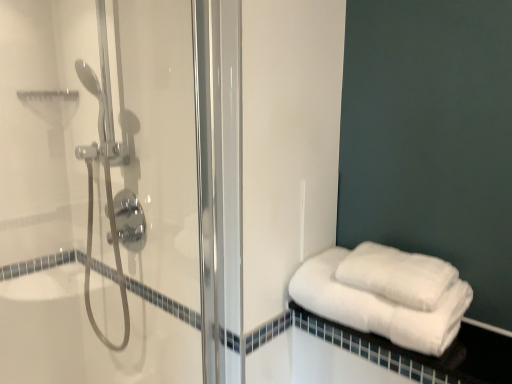
Question: Considering the relative sizes of clear glass shower door at left and white fluffy towels at right, marked as the second towel in a top-to-bottom arrangement, in the image provided, is clear glass shower door at left smaller than white fluffy towels at right, marked as the second towel in a top-to-bottom arrangement,?

Choices:
 (A) no
 (B) yes

Answer: (A)

Question: Is clear glass shower door at left positioned beyond the bounds of white fluffy towels at right, the first towel in the bottom-to-top sequence?

Choices:
 (A) yes
 (B) no

Answer: (A)

Question: Is the depth of clear glass shower door at left greater than that of white fluffy towels at right, marked as the second towel in a top-to-bottom arrangement?

Choices:
 (A) no
 (B) yes

Answer: (A)

Question: Does clear glass shower door at left have a larger size compared to white fluffy towels at right, marked as the second towel in a top-to-bottom arrangement?

Choices:
 (A) yes
 (B) no

Answer: (A)

Question: Considering the relative sizes of clear glass shower door at left and white fluffy towels at right, the first towel in the bottom-to-top sequence, in the image provided, is clear glass shower door at left taller than white fluffy towels at right, the first towel in the bottom-to-top sequence,?

Choices:
 (A) yes
 (B) no

Answer: (A)

Question: Considering the positions of white fluffy towels at right, the first towel in the bottom-to-top sequence, and white fluffy towels at lower right, which is the second towel from bottom to top, in the image, is white fluffy towels at right, the first towel in the bottom-to-top sequence, taller or shorter than white fluffy towels at lower right, which is the second towel from bottom to top,?

Choices:
 (A) tall
 (B) short

Answer: (A)

Question: Considering the positions of white fluffy towels at right, marked as the second towel in a top-to-bottom arrangement, and white fluffy towels at lower right, which is the second towel from bottom to top, in the image, is white fluffy towels at right, marked as the second towel in a top-to-bottom arrangement, bigger or smaller than white fluffy towels at lower right, which is the second towel from bottom to top,?

Choices:
 (A) big
 (B) small

Answer: (A)

Question: Is point (356, 324) closer or farther from the camera than point (394, 264)?

Choices:
 (A) closer
 (B) farther

Answer: (A)

Question: Is white fluffy towels at right, marked as the second towel in a top-to-bottom arrangement, situated inside white fluffy towels at lower right, which is the second towel from bottom to top, or outside?

Choices:
 (A) inside
 (B) outside

Answer: (B)

Question: From the image's perspective, is white fluffy towels at lower right, the 1th towel from the top, positioned above or below white cotton towels at lower right?

Choices:
 (A) above
 (B) below

Answer: (A)

Question: Is white fluffy towels at lower right, the 1th towel from the top, to the left or to the right of white cotton towels at lower right in the image?

Choices:
 (A) right
 (B) left

Answer: (B)

Question: Considering the positions of white fluffy towels at lower right, the 1th towel from the top, and white cotton towels at lower right in the image, is white fluffy towels at lower right, the 1th towel from the top, wider or thinner than white cotton towels at lower right?

Choices:
 (A) wide
 (B) thin

Answer: (B)

Question: Does point (355, 281) appear closer or farther from the camera than point (418, 360)?

Choices:
 (A) farther
 (B) closer

Answer: (A)

Question: In the image, is white cotton towels at lower right positioned in front of or behind white fluffy towels at lower right, which is the second towel from bottom to top?

Choices:
 (A) front
 (B) behind

Answer: (A)

Question: Do you think white cotton towels at lower right is within white fluffy towels at lower right, which is the second towel from bottom to top, or outside of it?

Choices:
 (A) inside
 (B) outside

Answer: (B)